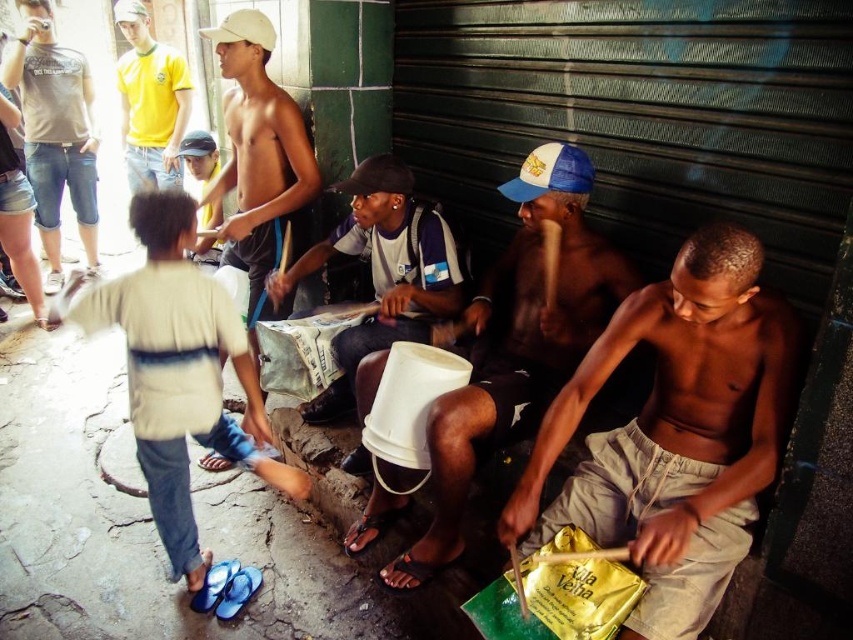
Which of these two, yellow jersey at upper left or white and blue fabric cap at upper center, stands taller?

Standing taller between the two is yellow jersey at upper left.

Can you confirm if yellow jersey at upper left is bigger than white and blue fabric cap at upper center?

Yes.

Is point (131, 156) positioned after point (589, 168)?

Yes, point (131, 156) is farther from viewer.

At what (x,y) coordinates should I click in order to perform the action: click on yellow jersey at upper left. Please return your answer as a coordinate pair (x, y). Looking at the image, I should click on (149, 100).

Which is in front, point (223, 435) or point (245, 36)?

Point (223, 435) is more forward.

Consider the image. Is light blue denim jeans at lower left to the left of white matte cap at upper center from the viewer's perspective?

Correct, you'll find light blue denim jeans at lower left to the left of white matte cap at upper center.

At what (x,y) coordinates should I click in order to perform the action: click on light blue denim jeans at lower left. Please return your answer as a coordinate pair (x, y). The image size is (853, 640). Looking at the image, I should click on (178, 371).

Is matte gray t-shirt at center to the left of black fabric cap at center from the viewer's perspective?

Yes, matte gray t-shirt at center is to the left of black fabric cap at center.

Can you confirm if matte gray t-shirt at center is bigger than black fabric cap at center?

Indeed, matte gray t-shirt at center has a larger size compared to black fabric cap at center.

Find the location of a particular element. This screenshot has height=640, width=853. matte gray t-shirt at center is located at coordinates (55, 131).